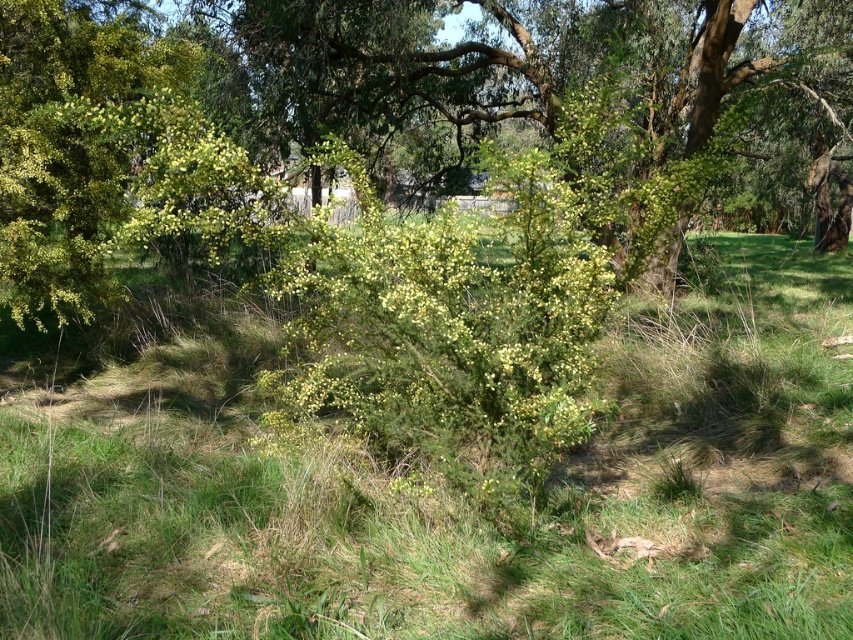
You are a gardener who wants to plant a new flower bed. You have two areas to choose from in the scene. One is the green grassy at center and the other is the green leafy bush at center. Which area has more space to accommodate larger plants?

The green grassy at center is thinner than the green leafy bush at center, so the green grassy at center has more space to accommodate larger plants.

You are a gardener who wants to plant a new flower bed. You have two areas to choose from in the scene described. One is the green grassy at center and the other is the green leafy bush at center. Based on their heights, which area would be more suitable for planting new flowers that require a lower ground level?

The green grassy at center has a lesser height compared to the green leafy bush at center, so it would be more suitable for planting new flowers that require a lower ground level.